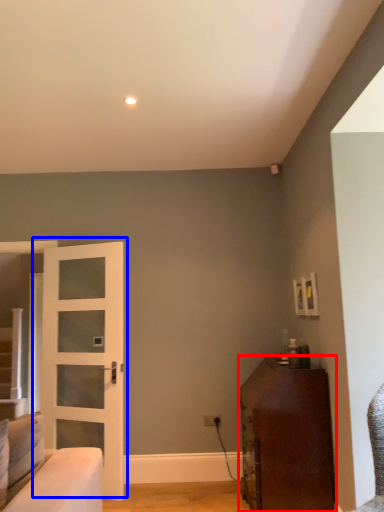
Question: Which point is closer to the camera, furniture (highlighted by a red box) or door (highlighted by a blue box)?

Choices:
 (A) furniture
 (B) door

Answer: (A)